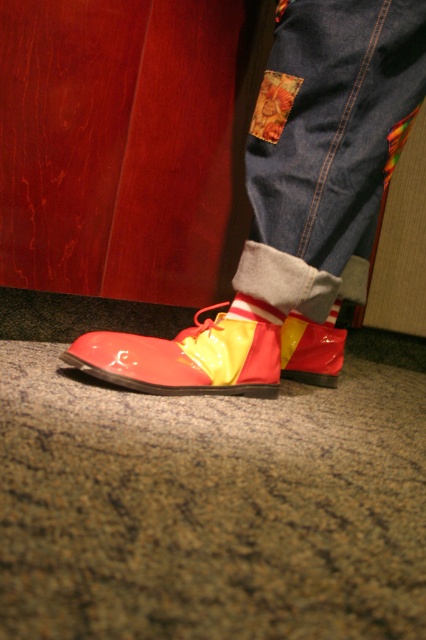
Question: Which object is farther from the camera taking this photo?

Choices:
 (A) yellow/red striped sock at lower center
 (B) glossy patent leather shoes at lower center

Answer: (A)

Question: Based on their relative distances, which object is farther from the glossy patent leather shoe at lower center?

Choices:
 (A) yellow/red striped sock at lower center
 (B) yellow matte sock at lower center

Answer: (B)

Question: Observing the image, what is the correct spatial positioning of glossy patent leather shoes at lower center in reference to yellow/red striped sock at lower center?

Choices:
 (A) left
 (B) right

Answer: (A)

Question: Can you confirm if glossy patent leather shoe at lower left is positioned to the right of yellow matte sock at lower center?

Choices:
 (A) yes
 (B) no

Answer: (B)

Question: Does glossy patent leather shoes at lower center come behind yellow matte sock at lower center?

Choices:
 (A) no
 (B) yes

Answer: (A)

Question: Which point appears closest to the camera in this image?

Choices:
 (A) (336, 291)
 (B) (405, 36)
 (C) (238, 292)
 (D) (301, 364)

Answer: (B)